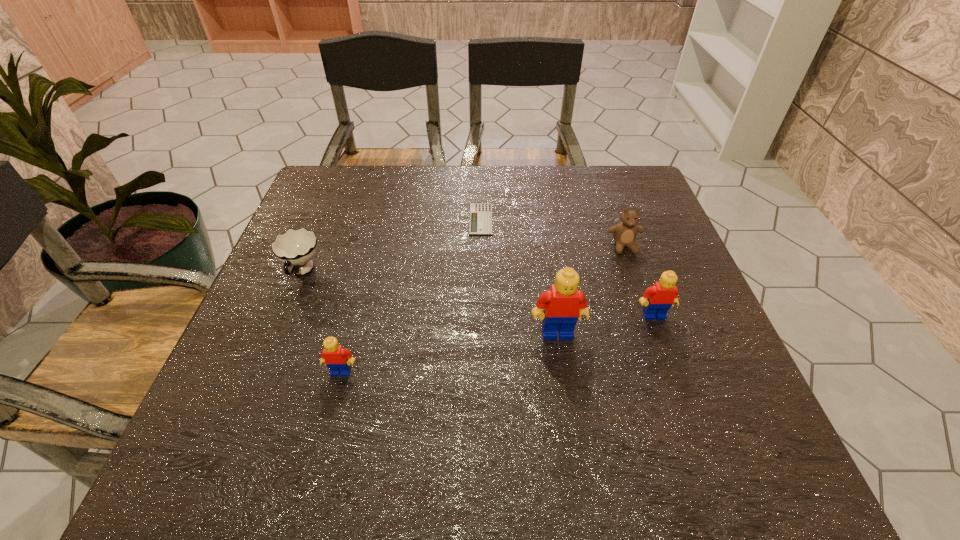
The height and width of the screenshot is (540, 960). In order to click on the leftmost Lego in this screenshot , I will do `click(337, 359)`.

This screenshot has width=960, height=540. What are the coordinates of `the nearest Lego` in the screenshot? It's located at coord(337,359).

Locate an element on the screen. The height and width of the screenshot is (540, 960). the tallest object is located at coordinates (563, 303).

Where is `the fourth object from left to right`? the fourth object from left to right is located at coordinates (563, 303).

At what (x,y) coordinates should I click in order to perform the action: click on the fourth farthest object. Please return your answer as a coordinate pair (x, y). Image resolution: width=960 pixels, height=540 pixels. Looking at the image, I should click on (658, 299).

Locate an element on the screen. The image size is (960, 540). the farthest Lego is located at coordinates (658, 299).

At what (x,y) coordinates should I click in order to perform the action: click on the third object from left to right. Please return your answer as a coordinate pair (x, y). The height and width of the screenshot is (540, 960). Looking at the image, I should click on (480, 220).

Find the location of a particular element. The width and height of the screenshot is (960, 540). the shortest object is located at coordinates (480, 220).

Find the location of a particular element. Image resolution: width=960 pixels, height=540 pixels. the leftmost object is located at coordinates (296, 247).

Where is `the second shortest object`? Image resolution: width=960 pixels, height=540 pixels. the second shortest object is located at coordinates (x=296, y=247).